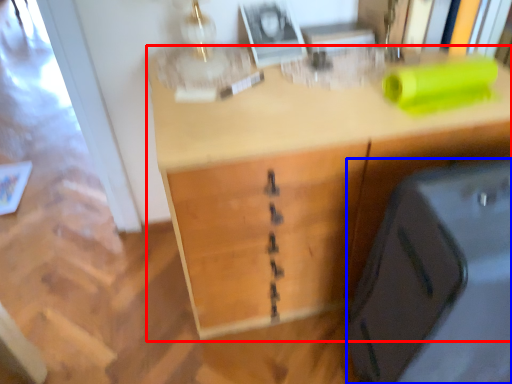
Question: Which object is further to the camera taking this photo, desk (highlighted by a red box) or luggage (highlighted by a blue box)?

Choices:
 (A) desk
 (B) luggage

Answer: (A)